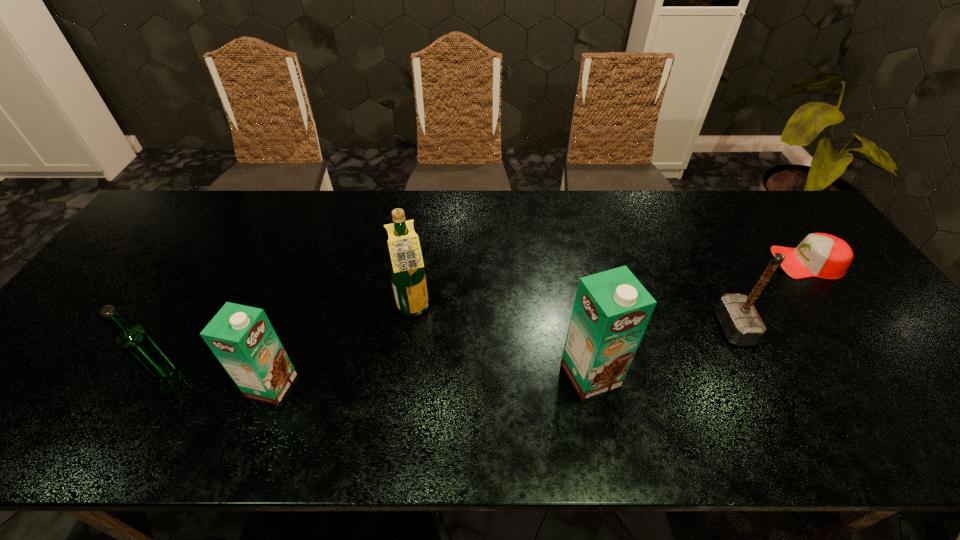
Considering the uniform spacing of cartons, where should an additional carton be positioned on the right? Please locate a free spot. Please provide its 2D coordinates. Your answer should be formatted as a tuple, i.e. [(x, y)], where the tuple contains the x and y coordinates of a point satisfying the conditions above.

[(897, 364)]